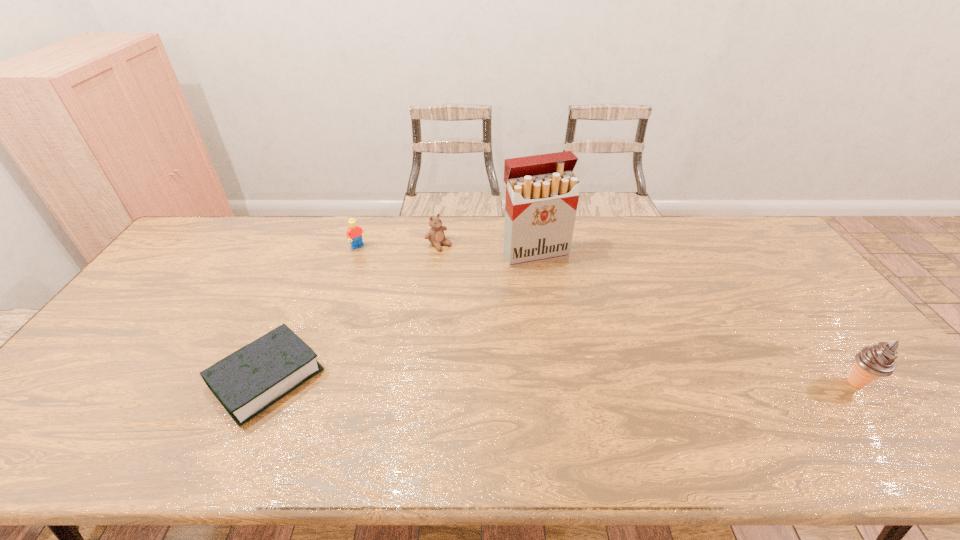
The height and width of the screenshot is (540, 960). What are the coordinates of `vacant space on the desktop that is between the shortest object and the second tallest object and is positioned on the front-facing side of the teddy bear` in the screenshot? It's located at tap(620, 381).

In order to click on free space on the desktop that is between the shortest object and the fourth shortest object and is positioned with the lid open on the tallest object in this screenshot , I will do `click(612, 381)`.

Find the location of `free space on the desktop that is between the Bible and the rightmost object and is positioned on the face of the Lego`. free space on the desktop that is between the Bible and the rightmost object and is positioned on the face of the Lego is located at coordinates (475, 380).